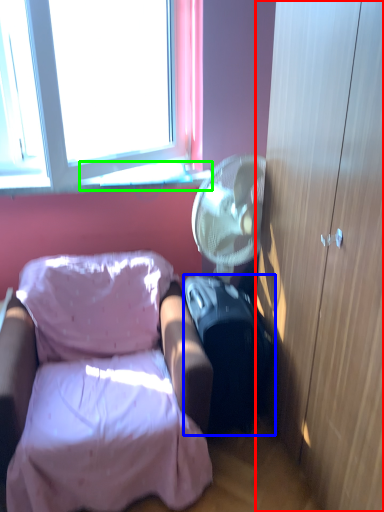
Question: Which is nearer to the cabinetry (highlighted by a red box)? suitcase (highlighted by a blue box) or window sill (highlighted by a green box).

Choices:
 (A) suitcase
 (B) window sill

Answer: (A)